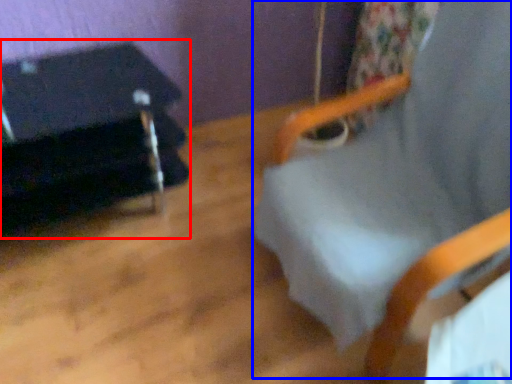
Question: Among these objects, which one is farthest to the camera, furniture (highlighted by a red box) or beach chair (highlighted by a blue box)?

Choices:
 (A) furniture
 (B) beach chair

Answer: (A)